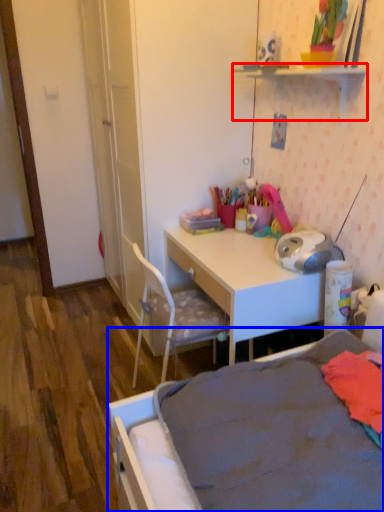
Question: Among these objects, which one is nearest to the camera, shelf (highlighted by a red box) or bed (highlighted by a blue box)?

Choices:
 (A) shelf
 (B) bed

Answer: (B)